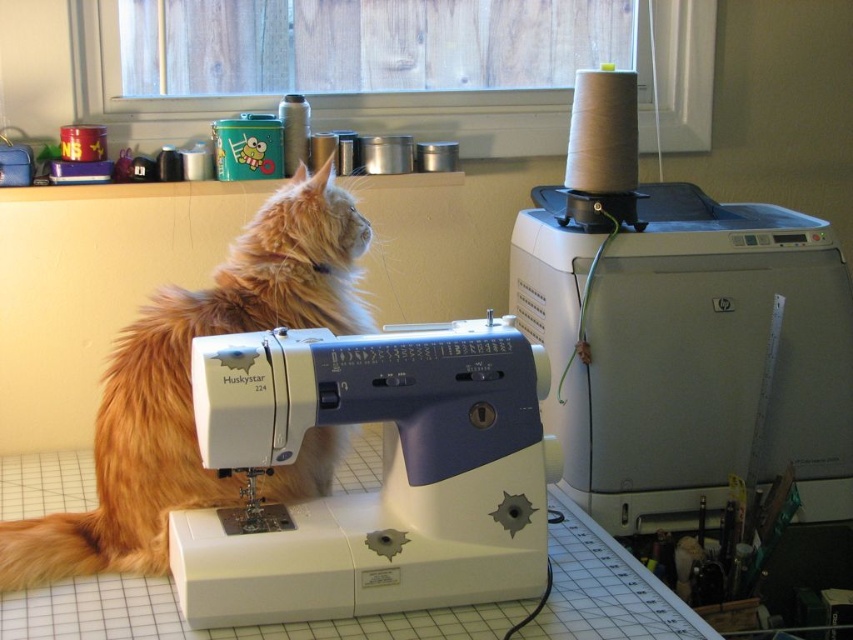
From the picture: Is white plastic sewing machine at center further to camera compared to fluffy orange cat at left?

That is False.

Can you confirm if white plastic sewing machine at center is taller than fluffy orange cat at left?

No, white plastic sewing machine at center is not taller than fluffy orange cat at left.

Who is more distant from viewer, [521,472] or [364,221]?

Positioned behind is point [364,221].

Locate an element on the screen. This screenshot has width=853, height=640. white plastic sewing machine at center is located at coordinates (384, 474).

Which is behind, point (799, 372) or point (451, 602)?

The point (799, 372) is more distant.

Does white plastic sewing machine at upper right appear under white plastic sewing machine at center?

No.

The height and width of the screenshot is (640, 853). What do you see at coordinates (680, 332) in the screenshot? I see `white plastic sewing machine at upper right` at bounding box center [680, 332].

I want to click on white plastic sewing machine at upper right, so click(x=680, y=332).

Measure the distance between white plastic sewing machine at upper right and fluffy orange cat at left.

They are 24.34 inches apart.

The height and width of the screenshot is (640, 853). Describe the element at coordinates (680, 332) in the screenshot. I see `white plastic sewing machine at upper right` at that location.

Who is more distant from viewer, (572, 387) or (285, 236)?

The point (572, 387) is behind.

Where is `white plastic sewing machine at upper right`? The image size is (853, 640). white plastic sewing machine at upper right is located at coordinates (680, 332).